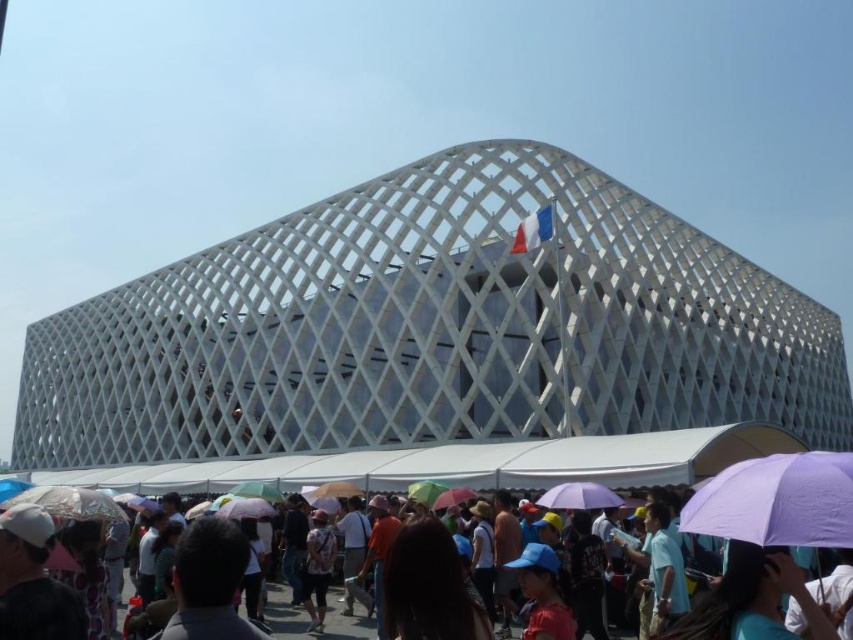
You are standing at the entrance of the modern building with the white lattice panels. You see a transparent plastic umbrella at lower left and a white matte umbrella at center. Which umbrella is closer to the ground?

The transparent plastic umbrella at lower left is located below the white matte umbrella at center, so it is closer to the ground.

You are at an event and see two umbrellas at the center area. Which one is positioned to the left when looking at the white matte umbrella at center and the multicolored fabric umbrella at center?

The white matte umbrella at center is positioned to the left of the multicolored fabric umbrella at center.